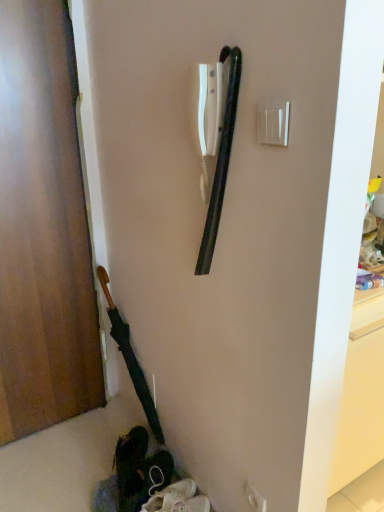
Question: Considering the relative sizes of white plastic light switch at upper right and wooden door at left in the image provided, is white plastic light switch at upper right taller than wooden door at left?

Choices:
 (A) no
 (B) yes

Answer: (A)

Question: From the image's perspective, is white plastic light switch at upper right beneath wooden door at left?

Choices:
 (A) yes
 (B) no

Answer: (B)

Question: Is the position of white plastic light switch at upper right less distant than that of wooden door at left?

Choices:
 (A) no
 (B) yes

Answer: (B)

Question: Can you confirm if white plastic light switch at upper right is wider than wooden door at left?

Choices:
 (A) yes
 (B) no

Answer: (B)

Question: Can you confirm if white plastic light switch at upper right is bigger than wooden door at left?

Choices:
 (A) no
 (B) yes

Answer: (A)

Question: Would you say wooden door at left is to the left or to the right of white plastic light switch at upper right in the picture?

Choices:
 (A) right
 (B) left

Answer: (B)

Question: From the image's perspective, is wooden door at left above or below white plastic light switch at upper right?

Choices:
 (A) below
 (B) above

Answer: (A)

Question: From a real-world perspective, is wooden door at left positioned above or below white plastic light switch at upper right?

Choices:
 (A) above
 (B) below

Answer: (B)

Question: Looking at their shapes, would you say wooden door at left is wider or thinner than white plastic light switch at upper right?

Choices:
 (A) thin
 (B) wide

Answer: (B)

Question: Is white plastic light switch at upper right situated inside white plastic electric outlet at center or outside?

Choices:
 (A) outside
 (B) inside

Answer: (A)

Question: Is point (263, 108) positioned closer to the camera than point (254, 504)?

Choices:
 (A) farther
 (B) closer

Answer: (B)

Question: Is white plastic light switch at upper right taller or shorter than white plastic electric outlet at center?

Choices:
 (A) short
 (B) tall

Answer: (B)

Question: From the image's perspective, is white plastic light switch at upper right above or below white plastic electric outlet at center?

Choices:
 (A) below
 (B) above

Answer: (B)

Question: From the image's perspective, is white plastic light switch at upper right positioned above or below wooden door at left?

Choices:
 (A) above
 (B) below

Answer: (A)

Question: Is white plastic light switch at upper right situated inside wooden door at left or outside?

Choices:
 (A) inside
 (B) outside

Answer: (B)